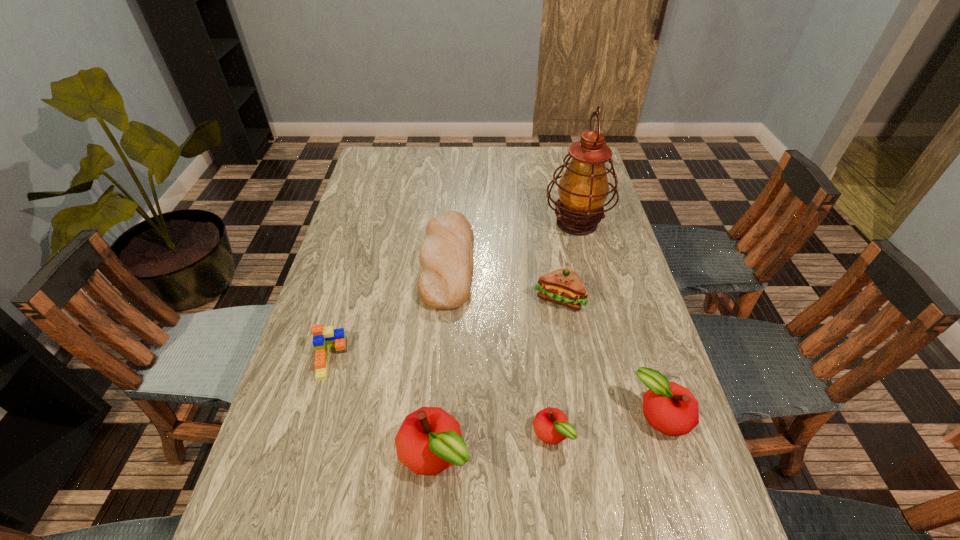
This screenshot has height=540, width=960. I want to click on vacant region located on the back of the second tallest apple, so pyautogui.click(x=645, y=362).

You are a GUI agent. You are given a task and a screenshot of the screen. Output one action in this format:
    pyautogui.click(x=<x>, y=<y>)
    Task: Click on the vacant space located on the front of the tallest object
    This screenshot has width=960, height=540.
    Given the screenshot: What is the action you would take?
    [x=590, y=279]

At what (x,y) coordinates should I click in order to perform the action: click on vacant space located 0.120m on the left of the sandwich. Please return your answer as a coordinate pair (x, y). The image size is (960, 540). Looking at the image, I should click on (492, 299).

The width and height of the screenshot is (960, 540). In order to click on vacant space located 0.280m on the back of the Lego in this screenshot , I will do `click(357, 264)`.

Locate an element on the screen. The width and height of the screenshot is (960, 540). vacant space located 0.110m on the left of the bread is located at coordinates (385, 261).

Find the location of a particular element. The image size is (960, 540). object that is positioned at the near edge is located at coordinates (429, 440).

Locate an element on the screen. The image size is (960, 540). object present at the left edge is located at coordinates (323, 337).

Identify the location of apple situated at the right edge. This screenshot has width=960, height=540. (670, 408).

Find the location of a particular element. oil lamp that is at the right edge is located at coordinates (583, 188).

In order to click on sandwich situated at the right edge in this screenshot , I will do `click(563, 286)`.